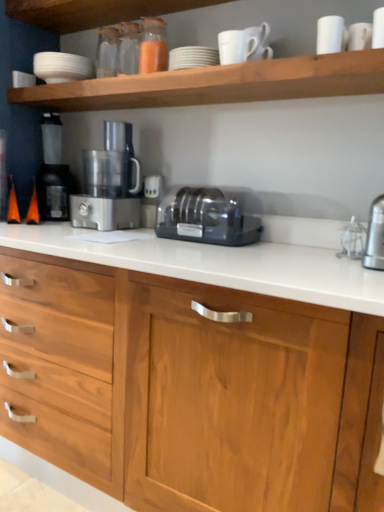
Question: Does white matte shelf at upper center have a lesser width compared to translucent glass spice at upper center?

Choices:
 (A) yes
 (B) no

Answer: (B)

Question: Does white matte shelf at upper center have a greater width compared to translucent glass spice at upper center?

Choices:
 (A) yes
 (B) no

Answer: (A)

Question: From the image's perspective, is white matte shelf at upper center above translucent glass spice at upper center?

Choices:
 (A) no
 (B) yes

Answer: (A)

Question: Considering the relative sizes of white matte shelf at upper center and translucent glass spice at upper center in the image provided, is white matte shelf at upper center shorter than translucent glass spice at upper center?

Choices:
 (A) no
 (B) yes

Answer: (B)

Question: From a real-world perspective, is white matte shelf at upper center positioned over translucent glass spice at upper center based on gravity?

Choices:
 (A) yes
 (B) no

Answer: (B)

Question: Is white matte shelf at upper center closer to the viewer compared to translucent glass spice at upper center?

Choices:
 (A) yes
 (B) no

Answer: (A)

Question: Is white matte bowl at upper left, which is the first tableware in top-to-bottom order, not near wooden cabinet at center?

Choices:
 (A) yes
 (B) no

Answer: (A)

Question: Can you confirm if white matte bowl at upper left, the 2th tableware from the bottom, is taller than wooden cabinet at center?

Choices:
 (A) yes
 (B) no

Answer: (B)

Question: Considering the relative positions of white matte bowl at upper left, which is the first tableware in top-to-bottom order, and wooden cabinet at center in the image provided, is white matte bowl at upper left, which is the first tableware in top-to-bottom order, to the right of wooden cabinet at center from the viewer's perspective?

Choices:
 (A) yes
 (B) no

Answer: (B)

Question: Considering the relative positions of white matte bowl at upper left, the first tableware viewed from the left, and wooden cabinet at center in the image provided, is white matte bowl at upper left, the first tableware viewed from the left, to the left of wooden cabinet at center from the viewer's perspective?

Choices:
 (A) yes
 (B) no

Answer: (A)

Question: Is white matte bowl at upper left, acting as the first tableware starting from the back, oriented towards wooden cabinet at center?

Choices:
 (A) yes
 (B) no

Answer: (B)

Question: Is white matte bowl at upper left, the first tableware viewed from the left, closer to camera compared to wooden cabinet at center?

Choices:
 (A) yes
 (B) no

Answer: (B)

Question: Can you confirm if white matte cup at upper right, the 1th tableware positioned from the right, is positioned to the left of black plastic toaster at center?

Choices:
 (A) yes
 (B) no

Answer: (B)